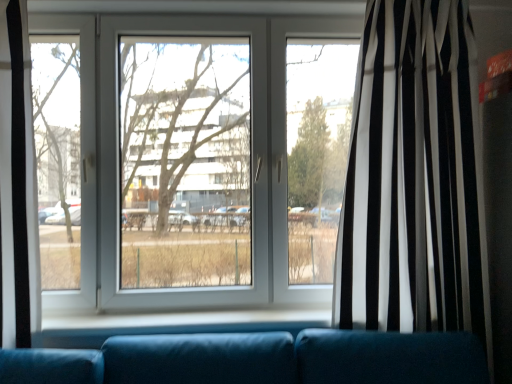
Question: Does black/white striped curtain at right have a lesser width compared to transparent glass window at center?

Choices:
 (A) yes
 (B) no

Answer: (B)

Question: From a real-world perspective, is black/white striped curtain at right on top of transparent glass window at center?

Choices:
 (A) yes
 (B) no

Answer: (B)

Question: Is black/white striped curtain at right in contact with transparent glass window at center?

Choices:
 (A) yes
 (B) no

Answer: (B)

Question: Is black/white striped curtain at right oriented away from transparent glass window at center?

Choices:
 (A) no
 (B) yes

Answer: (A)

Question: Is black/white striped curtain at right facing towards transparent glass window at center?

Choices:
 (A) no
 (B) yes

Answer: (A)

Question: Can you confirm if black/white striped curtain at right is bigger than transparent glass window at center?

Choices:
 (A) no
 (B) yes

Answer: (A)

Question: From the image's perspective, is transparent glass window at center beneath black/white striped curtain at right?

Choices:
 (A) no
 (B) yes

Answer: (A)

Question: From a real-world perspective, is transparent glass window at center located higher than black/white striped curtain at right?

Choices:
 (A) no
 (B) yes

Answer: (B)

Question: Is transparent glass window at center turned away from black/white striped curtain at right?

Choices:
 (A) yes
 (B) no

Answer: (B)

Question: Is transparent glass window at center positioned behind black/white striped curtain at right?

Choices:
 (A) no
 (B) yes

Answer: (B)

Question: Does transparent glass window at center turn towards black/white striped curtain at right?

Choices:
 (A) no
 (B) yes

Answer: (A)

Question: Can you confirm if transparent glass window at center is thinner than black/white striped curtain at right?

Choices:
 (A) yes
 (B) no

Answer: (A)

Question: Is black/white striped curtain at right to the left or to the right of transparent glass window at center in the image?

Choices:
 (A) right
 (B) left

Answer: (A)